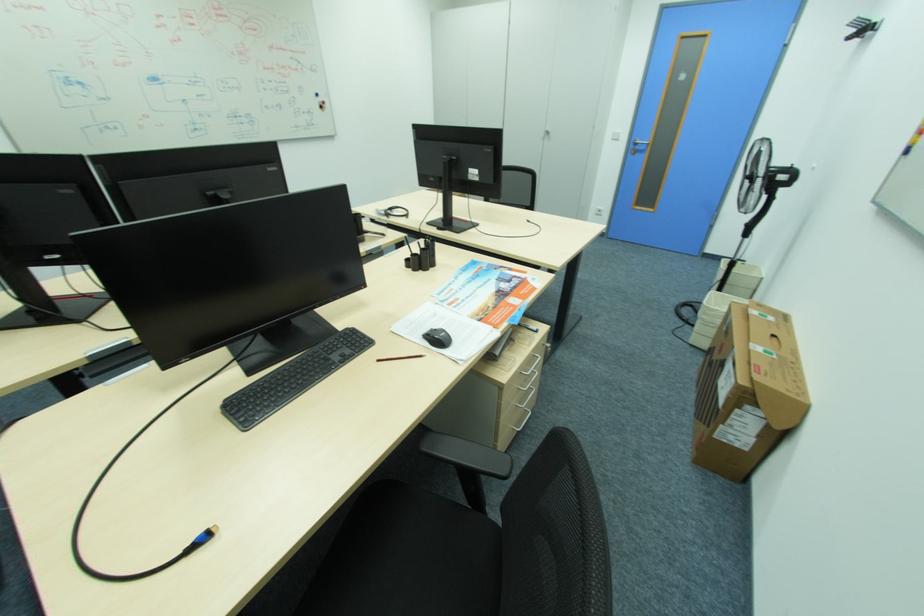
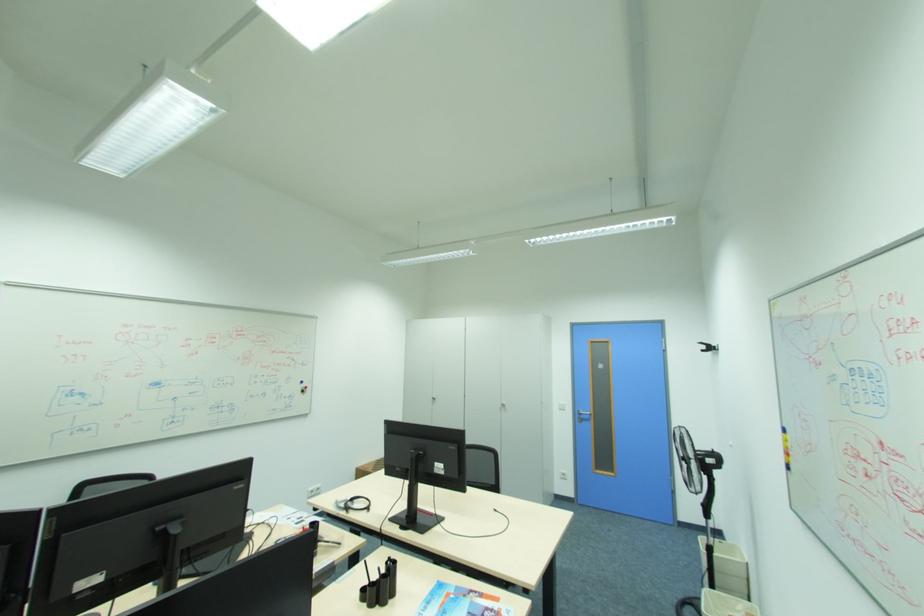
The point at (859, 33) is marked in the first image. Where is the corresponding point in the second image?

(708, 347)